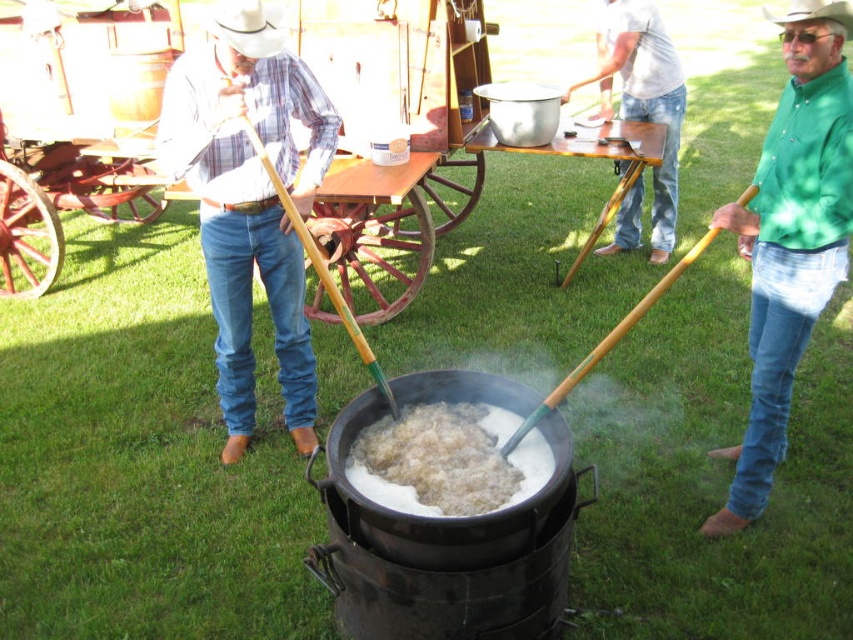
Consider the image. You are standing in front of the two men in the scene. Which point is closer to you? The point at coordinates point (x=604, y=35) or point (x=582, y=362)?

Point (x=582, y=362) is closer to you because it is less far from the camera than point (x=604, y=35).